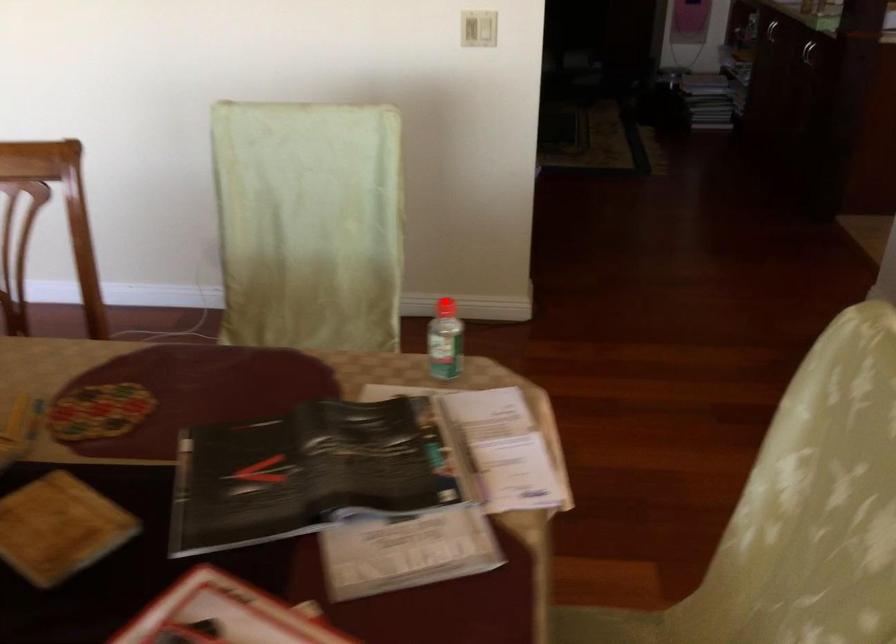
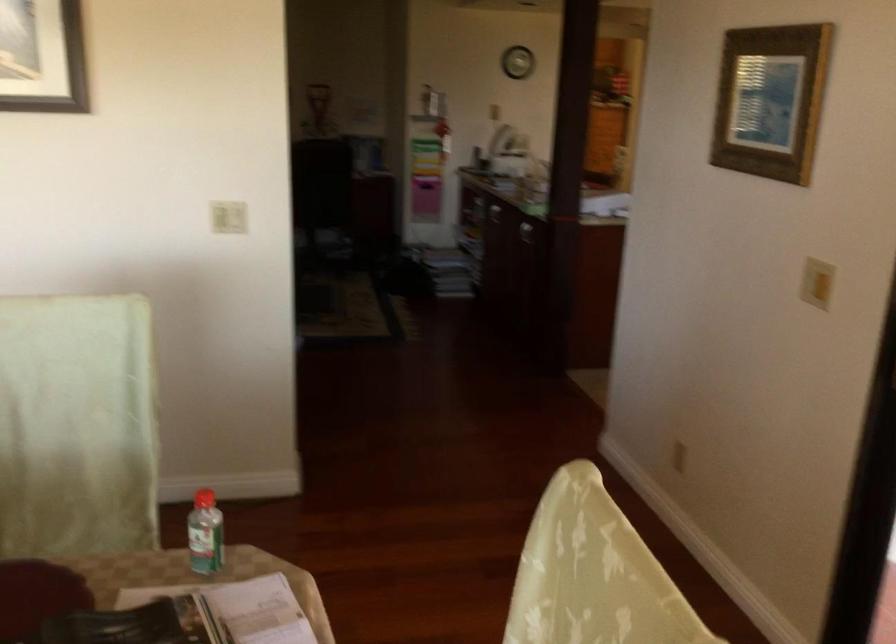
In the second image, find the point that corresponds to the highlighted location in the first image.

(203, 498)